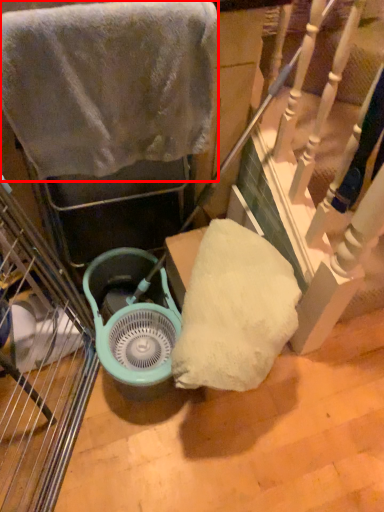
Question: From the image's perspective, where is towel (annotated by the red box) located in relation to fan in the image?

Choices:
 (A) above
 (B) below

Answer: (A)